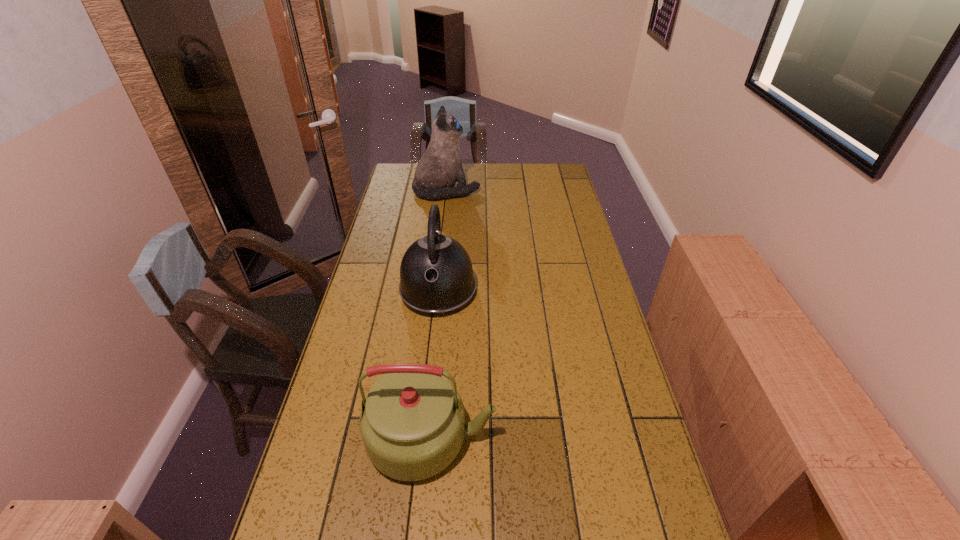
Image resolution: width=960 pixels, height=540 pixels. Find the location of `object that stands as the second closest to the second farthest object`. object that stands as the second closest to the second farthest object is located at coordinates (440, 167).